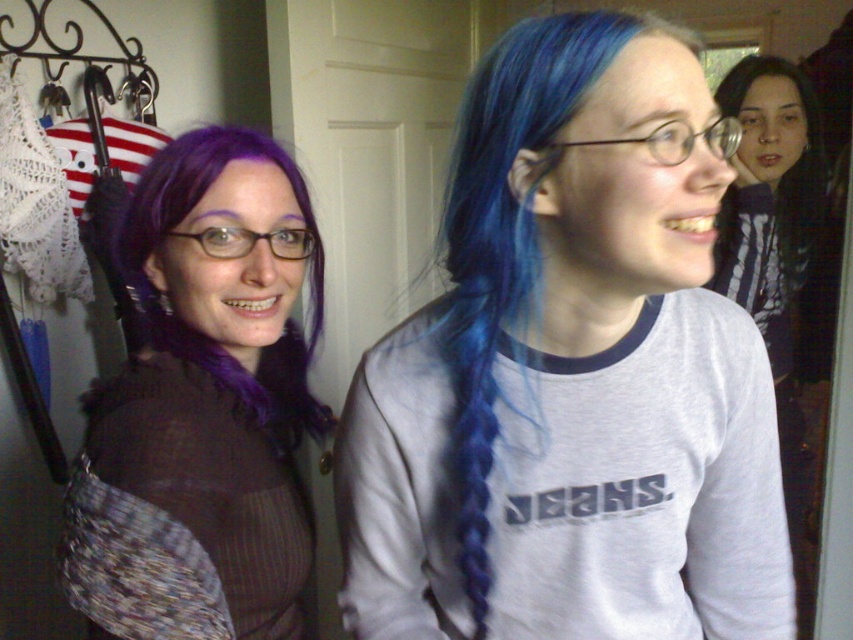
Is point (428, 394) in front of point (825, 193)?

Yes, point (428, 394) is in front of point (825, 193).

Does blue hair at center lie behind blue hair at upper right?

No, blue hair at center is in front of blue hair at upper right.

Is point (715, 358) more distant than point (784, 291)?

No, it is not.

The image size is (853, 640). In order to click on blue hair at center in this screenshot , I will do `click(572, 372)`.

Is purple matte hair at upper left closer to camera compared to blue dyed hair at upper right?

Yes, it is.

Which is below, purple matte hair at upper left or blue dyed hair at upper right?

purple matte hair at upper left

Is point (105, 596) farther from viewer compared to point (746, 86)?

No, it is not.

At what (x,y) coordinates should I click in order to perform the action: click on purple matte hair at upper left. Please return your answer as a coordinate pair (x, y). This screenshot has height=640, width=853. Looking at the image, I should click on (219, 376).

Does purple matte hair at upper left have a lesser height compared to blue hair at upper right?

Correct, purple matte hair at upper left is not as tall as blue hair at upper right.

Is point (189, 406) less distant than point (801, 422)?

Yes, it is in front of point (801, 422).

Image resolution: width=853 pixels, height=640 pixels. I want to click on purple matte hair at upper left, so click(219, 376).